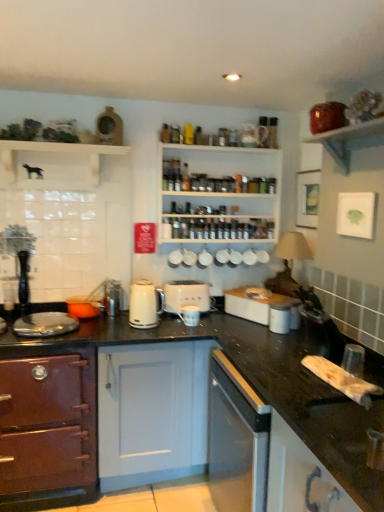
Locate an element on the screen. vacant area that lies to the right of white glossy kettle at center is located at coordinates (182, 330).